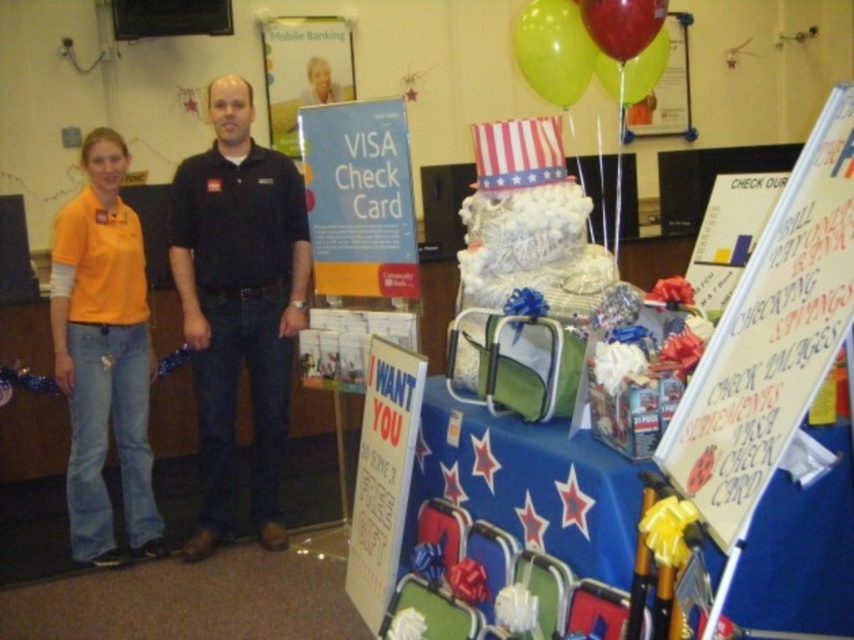
You are a photographer at the event and need to capture a closeup shot of the shiny metallic balloon at upper center without including the black cotton shirt at center. Given their sizes, is this possible?

The black cotton shirt at center is wider than the shiny metallic balloon at upper center. Since the shirt is wider, it might block the balloon in a closeup, making it difficult to capture the balloon without the shirt in the frame.

You are standing in front of the promotional setup for the Visa Check Card. There are two points marked on the display table. One is at coordinate point [214,396] and the other at point [617,10]. Which point is closer to you?

Point [214,396] is closer to you because it is further to the viewer than point [617,10].

You are a customer at the event and see the orange cotton shirt at left and the green rubber balloon at upper center. Which object is closer to you?

The orange cotton shirt at left is closer to you because the green rubber balloon at upper center is behind it.